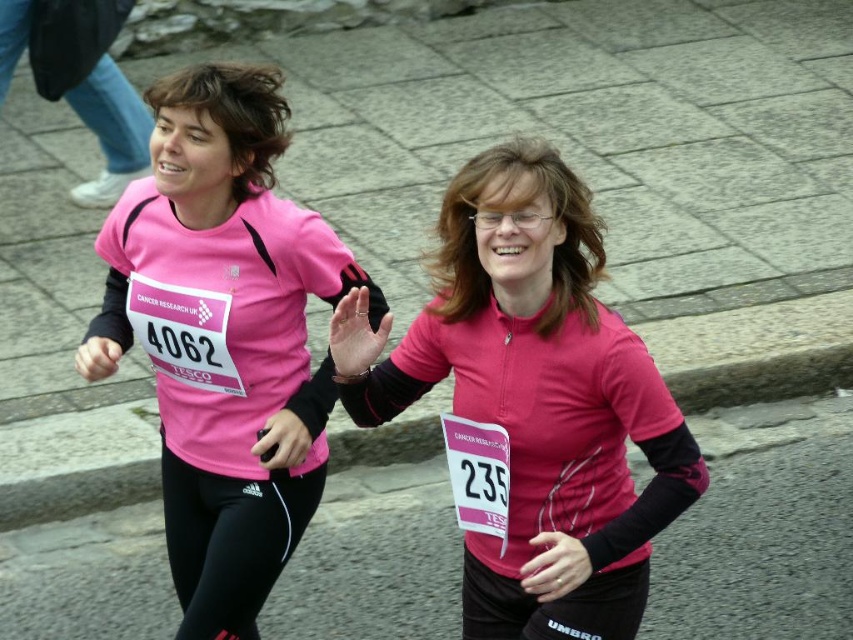
Which of these two, pink zip-up jacket at center or matte pink shirt at center, stands taller?

matte pink shirt at center

Does pink zip-up jacket at center have a greater height compared to matte pink shirt at center?

No, pink zip-up jacket at center is not taller than matte pink shirt at center.

The width and height of the screenshot is (853, 640). Find the location of `pink zip-up jacket at center`. pink zip-up jacket at center is located at coordinates pyautogui.click(x=534, y=397).

Identify the location of pink zip-up jacket at center. The height and width of the screenshot is (640, 853). (534, 397).